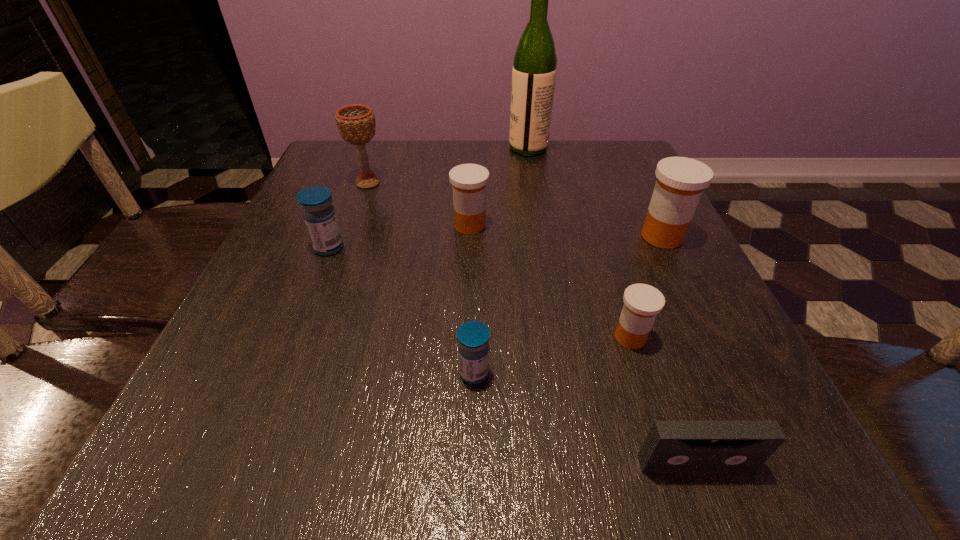
You are a GUI agent. You are given a task and a screenshot of the screen. Output one action in this format:
    pyautogui.click(x=<x>, y=<y>)
    Task: Click on the fourth object from right to left
    
    Given the screenshot: What is the action you would take?
    pyautogui.click(x=534, y=69)

Where is `liquor`? The width and height of the screenshot is (960, 540). liquor is located at coordinates (534, 69).

I want to click on the second farthest object, so click(x=356, y=123).

This screenshot has width=960, height=540. What are the coordinates of `beige chalice` in the screenshot? It's located at (356, 123).

Locate an element on the screen. The width and height of the screenshot is (960, 540). the tallest medicine is located at coordinates click(680, 182).

The width and height of the screenshot is (960, 540). What are the coordinates of `the rightmost orange medicine` in the screenshot? It's located at (680, 182).

Where is `the leftmost orange medicine`? the leftmost orange medicine is located at coordinates (468, 181).

The image size is (960, 540). What are the coordinates of `the bigger blue medicine` in the screenshot? It's located at (319, 215).

Where is `the left blue medicine`? This screenshot has width=960, height=540. the left blue medicine is located at coordinates pos(319,215).

This screenshot has width=960, height=540. What are the coordinates of `the smallest orange medicine` in the screenshot? It's located at (642, 302).